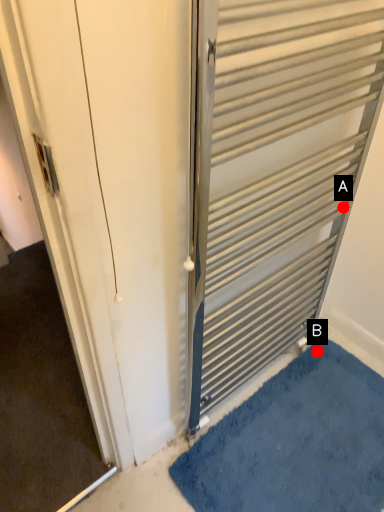
Question: Two points are circled on the image, labeled by A and B beside each circle. Which point is closer to the camera taking this photo?

Choices:
 (A) A is closer
 (B) B is closer

Answer: (A)